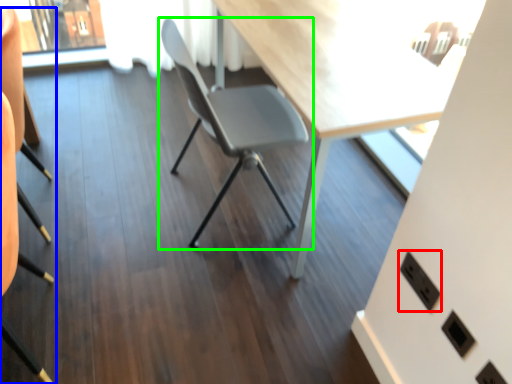
Question: Which object is positioned closest to electric outlet (highlighted by a red box)? Select from chair (highlighted by a blue box) and chair (highlighted by a green box).

Choices:
 (A) chair
 (B) chair

Answer: (B)